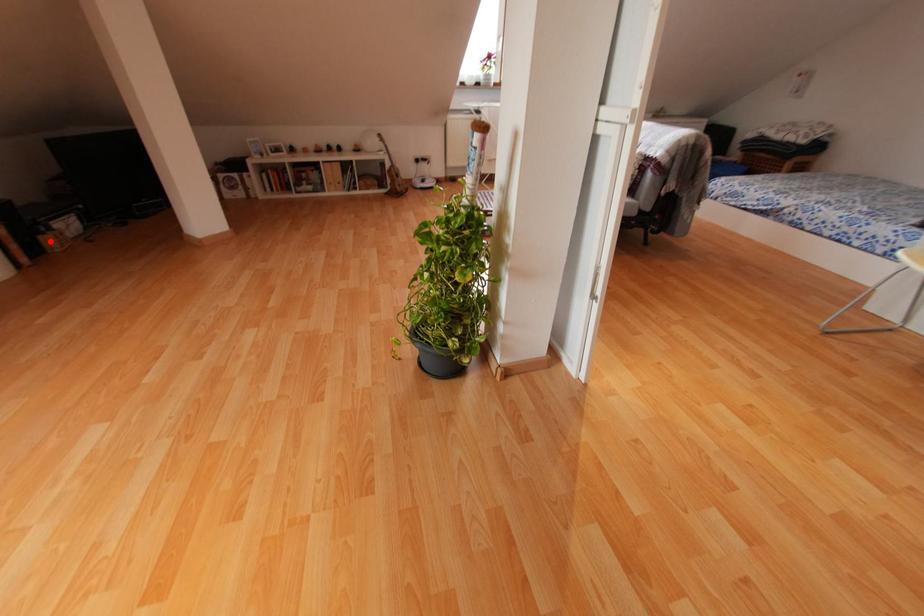
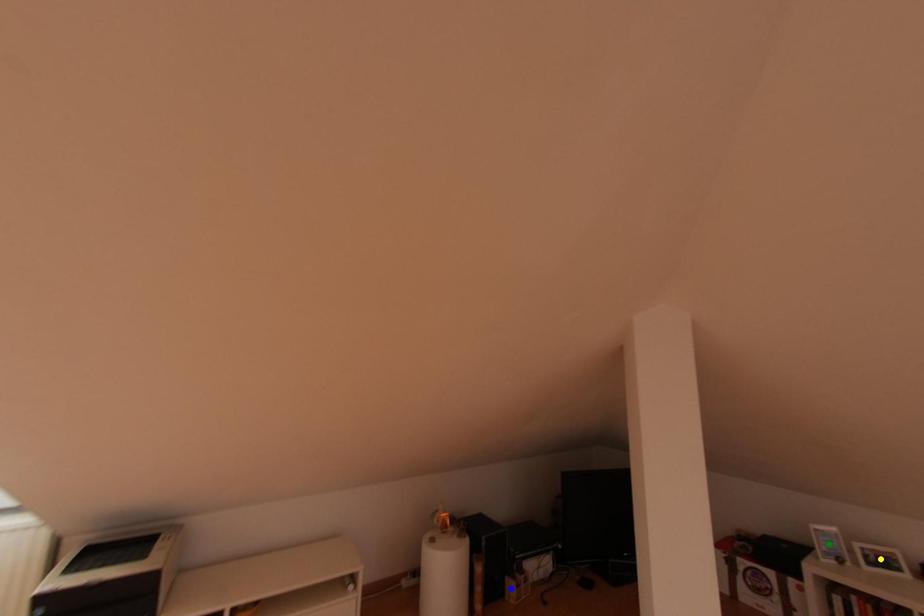
Question: I am providing you with two images of the same scene from different viewpoints. A red point is marked on the first image. You are given multiple points on the second image. In image 2, which mark is for the same physical point as the one in image 1?

Choices:
 (A) blue point
 (B) yellow point
 (C) green point

Answer: (A)